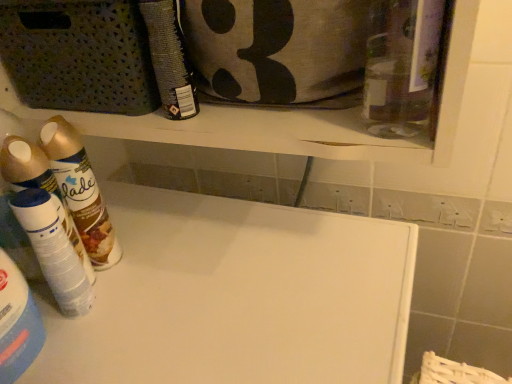
The height and width of the screenshot is (384, 512). Identify the location of vacant space in front of gold metallic spray can at left, the third cleaning product positioned from the right. (112, 324).